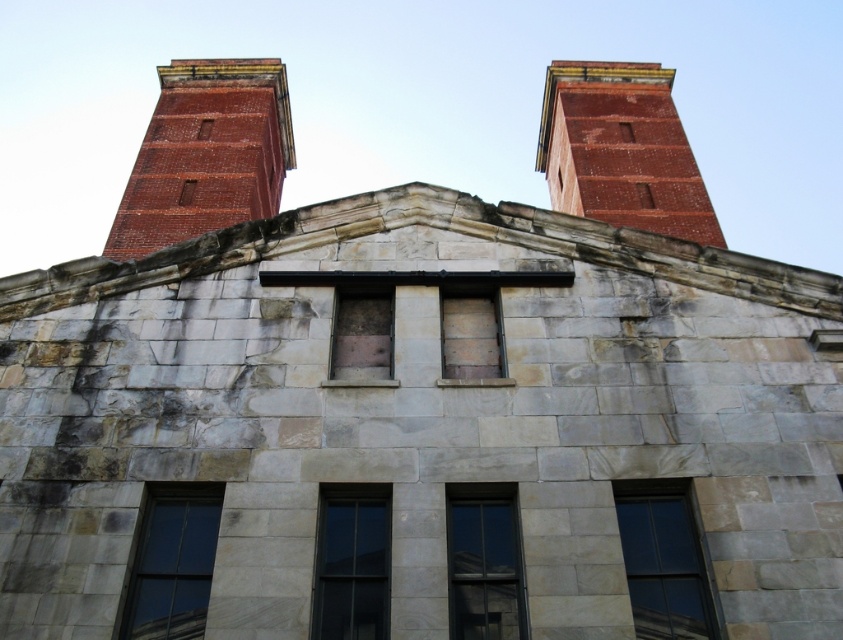
Question: Which is nearer to the clear glass window at center?

Choices:
 (A) clear glass window at lower left
 (B) wooden boarded window at center
 (C) clear glass window at lower right
 (D) brick tower at upper left

Answer: (C)

Question: Which object appears closest to the camera in this image?

Choices:
 (A) clear glass window at lower left
 (B) transparent glass window at center
 (C) clear glass window at center

Answer: (B)

Question: Estimate the real-world distances between objects in this image. Which object is closer to the brick tower at upper left?

Choices:
 (A) clear glass window at center
 (B) wooden boarded window at center
 (C) clear glass window at lower left

Answer: (B)

Question: Is transparent glass window at center below clear glass window at center?

Choices:
 (A) no
 (B) yes

Answer: (A)

Question: From the image, what is the correct spatial relationship of transparent glass window at center in relation to brown wooden window at center?

Choices:
 (A) right
 (B) left

Answer: (A)

Question: Does transparent glass window at center appear under clear glass window at center?

Choices:
 (A) yes
 (B) no

Answer: (B)